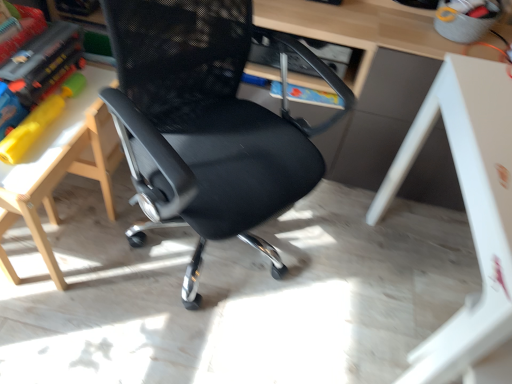
Question: Considering the relative sizes of matte plastic book at left and white glossy table at lower right, which is counted as the 2th table, starting from the left, in the image provided, is matte plastic book at left bigger than white glossy table at lower right, which is counted as the 2th table, starting from the left,?

Choices:
 (A) no
 (B) yes

Answer: (A)

Question: Is matte plastic book at left oriented away from white glossy table at lower right, arranged as the first table when viewed from the right?

Choices:
 (A) no
 (B) yes

Answer: (A)

Question: From a real-world perspective, is matte plastic book at left beneath white glossy table at lower right, arranged as the first table when viewed from the right?

Choices:
 (A) no
 (B) yes

Answer: (A)

Question: Is the surface of matte plastic book at left in direct contact with white glossy table at lower right, arranged as the first table when viewed from the right?

Choices:
 (A) yes
 (B) no

Answer: (B)

Question: Is matte plastic book at left outside of white glossy table at lower right, which is counted as the 2th table, starting from the left?

Choices:
 (A) no
 (B) yes

Answer: (B)

Question: Do you think matte plastic book at left is within white glossy table at lower right, arranged as the first table when viewed from the right, or outside of it?

Choices:
 (A) inside
 (B) outside

Answer: (B)

Question: From their relative heights in the image, would you say matte plastic book at left is taller or shorter than white glossy table at lower right, which is counted as the 2th table, starting from the left?

Choices:
 (A) short
 (B) tall

Answer: (A)

Question: From a real-world perspective, is matte plastic book at left positioned above or below white glossy table at lower right, which is counted as the 2th table, starting from the left?

Choices:
 (A) above
 (B) below

Answer: (A)

Question: Is point pos(35,89) positioned closer to the camera than point pos(497,160)?

Choices:
 (A) farther
 (B) closer

Answer: (A)

Question: From their relative heights in the image, would you say white wood table at left, arranged as the 1th table when viewed from the left, is taller or shorter than matte plastic book at left?

Choices:
 (A) short
 (B) tall

Answer: (B)

Question: Does point (94, 119) appear closer or farther from the camera than point (29, 104)?

Choices:
 (A) farther
 (B) closer

Answer: (A)

Question: Is white wood table at left, arranged as the 1th table when viewed from the left, in front of or behind matte plastic book at left in the image?

Choices:
 (A) behind
 (B) front

Answer: (B)

Question: Would you say white wood table at left, arranged as the 2th table when viewed from the right, is inside or outside matte plastic book at left?

Choices:
 (A) inside
 (B) outside

Answer: (B)

Question: Relative to black mesh chair at center, is white glossy table at lower right, which is counted as the 2th table, starting from the left, in front or behind?

Choices:
 (A) behind
 (B) front

Answer: (A)

Question: Considering the positions of white glossy table at lower right, arranged as the first table when viewed from the right, and black mesh chair at center in the image, is white glossy table at lower right, arranged as the first table when viewed from the right, bigger or smaller than black mesh chair at center?

Choices:
 (A) big
 (B) small

Answer: (B)